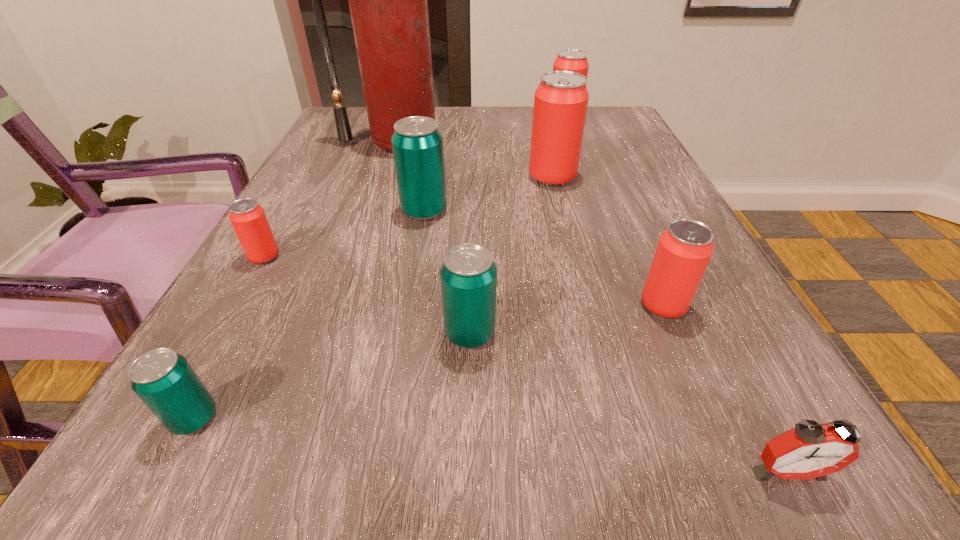
Locate an element on the screen. free space between the nearest red beer can and the tallest object is located at coordinates (529, 225).

Where is `free space that is in between the red fire extinguisher and the seventh nearest object`? The width and height of the screenshot is (960, 540). free space that is in between the red fire extinguisher and the seventh nearest object is located at coordinates (473, 161).

The image size is (960, 540). Find the location of `empty location between the fourth farthest object and the nearest object`. empty location between the fourth farthest object and the nearest object is located at coordinates (606, 340).

You are a GUI agent. You are given a task and a screenshot of the screen. Output one action in this format:
    pyautogui.click(x=<x>, y=<y>)
    Task: Click on the vacant region between the nearest red beer can and the leftmost teal beer can
    This screenshot has width=960, height=540.
    Given the screenshot: What is the action you would take?
    429,362

Image resolution: width=960 pixels, height=540 pixels. I want to click on free space between the fifth nearest object and the fifth beer can from right to left, so click(x=345, y=234).

You are a GUI agent. You are given a task and a screenshot of the screen. Output one action in this format:
    pyautogui.click(x=<x>, y=<y>)
    Task: Click on the free space between the fifth object from left to right and the farthest object
    This screenshot has height=540, width=960.
    Given the screenshot: What is the action you would take?
    pyautogui.click(x=516, y=228)

Identify the location of vacant point located between the second nearest teal beer can and the leftmost red beer can. This screenshot has width=960, height=540. (367, 295).

This screenshot has width=960, height=540. I want to click on unoccupied area between the nearest beer can and the fifth object from right to left, so click(332, 376).

Identify which object is located as the fourth nearest to the farthest beer can. Please provide its 2D coordinates. Your answer should be formatted as a tuple, i.e. [(x, y)], where the tuple contains the x and y coordinates of a point satisfying the conditions above.

[(684, 250)]

Locate which object is the eighth closest to the leftmost teal beer can. Please provide its 2D coordinates. Your answer should be formatted as a tuple, i.e. [(x, y)], where the tuple contains the x and y coordinates of a point satisfying the conditions above.

[(574, 60)]